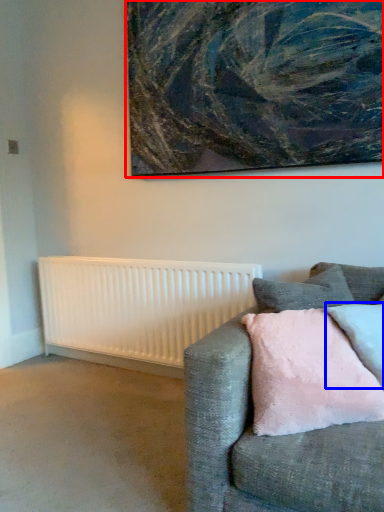
Question: Which of the following is the farthest to the observer, picture frame (highlighted by a red box) or pillow (highlighted by a blue box)?

Choices:
 (A) picture frame
 (B) pillow

Answer: (A)